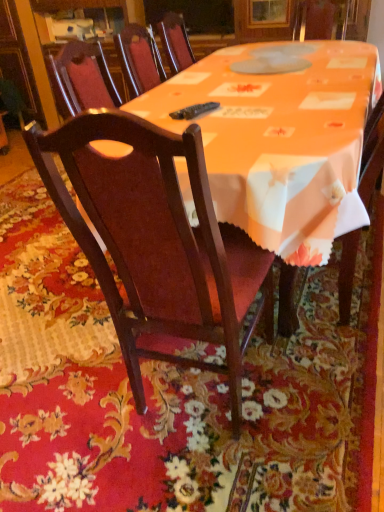
I want to click on vacant area located to the right-hand side of mahogany wood chair at center, so click(x=314, y=392).